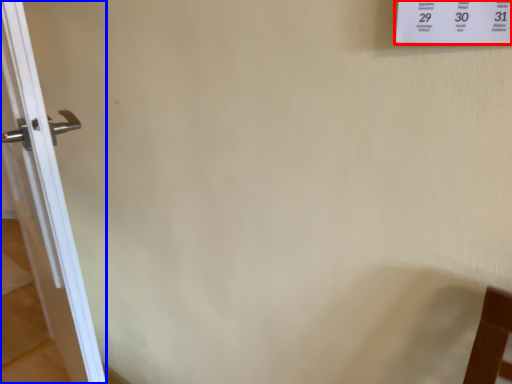
Question: Which object is closer to the camera taking this photo, poster (highlighted by a red box) or door (highlighted by a blue box)?

Choices:
 (A) poster
 (B) door

Answer: (A)